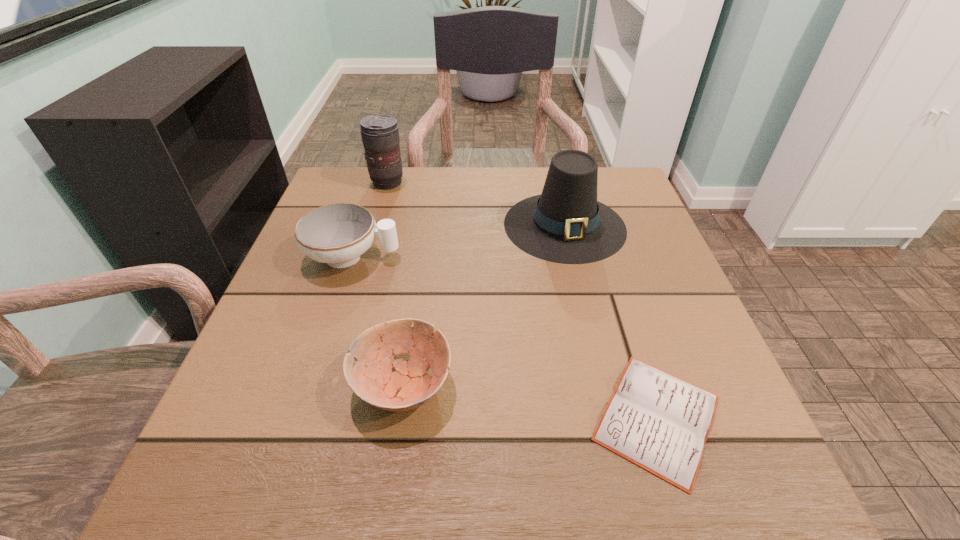
The height and width of the screenshot is (540, 960). Find the location of `free space at the far edge of the desktop`. free space at the far edge of the desktop is located at coordinates (444, 178).

The height and width of the screenshot is (540, 960). Find the location of `blank space at the near edge of the desktop`. blank space at the near edge of the desktop is located at coordinates (535, 470).

Locate an element on the screen. The height and width of the screenshot is (540, 960). free spot at the left edge of the desktop is located at coordinates (223, 428).

This screenshot has width=960, height=540. Find the location of `free space at the right edge`. free space at the right edge is located at coordinates (648, 357).

Identify the location of free point at the near right corner. Image resolution: width=960 pixels, height=540 pixels. (713, 508).

Find the location of a particular element. The height and width of the screenshot is (540, 960). vacant area that lies between the second shortest object and the hat is located at coordinates (484, 305).

Where is `free spot between the hat and the diary`? This screenshot has height=540, width=960. free spot between the hat and the diary is located at coordinates (611, 321).

The width and height of the screenshot is (960, 540). Find the location of `free space between the second shortest object and the chinaware`. free space between the second shortest object and the chinaware is located at coordinates (378, 321).

The width and height of the screenshot is (960, 540). Identify the location of empty location between the farthest object and the hat. (476, 204).

Where is `vacant area that lies between the hat and the chinaware`? vacant area that lies between the hat and the chinaware is located at coordinates [459, 241].